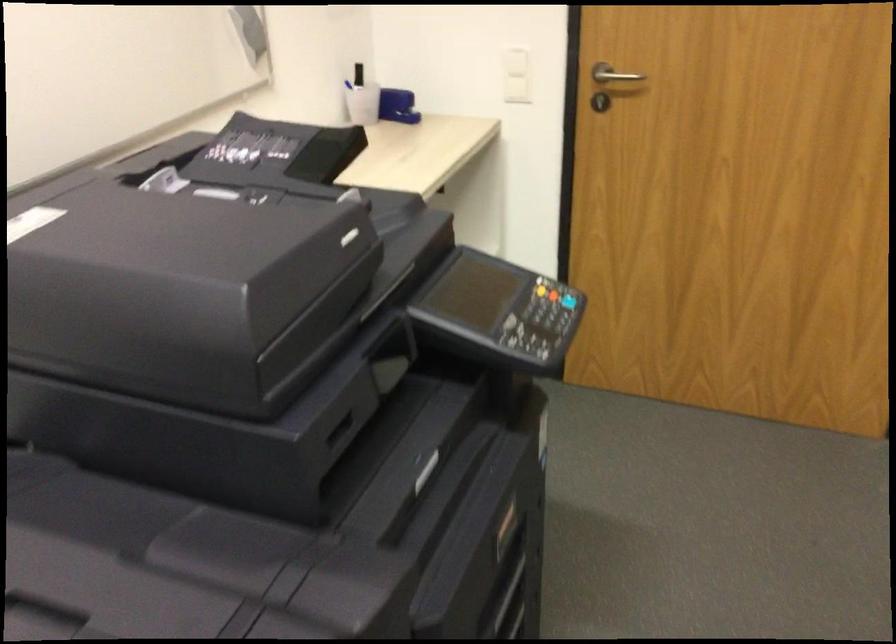
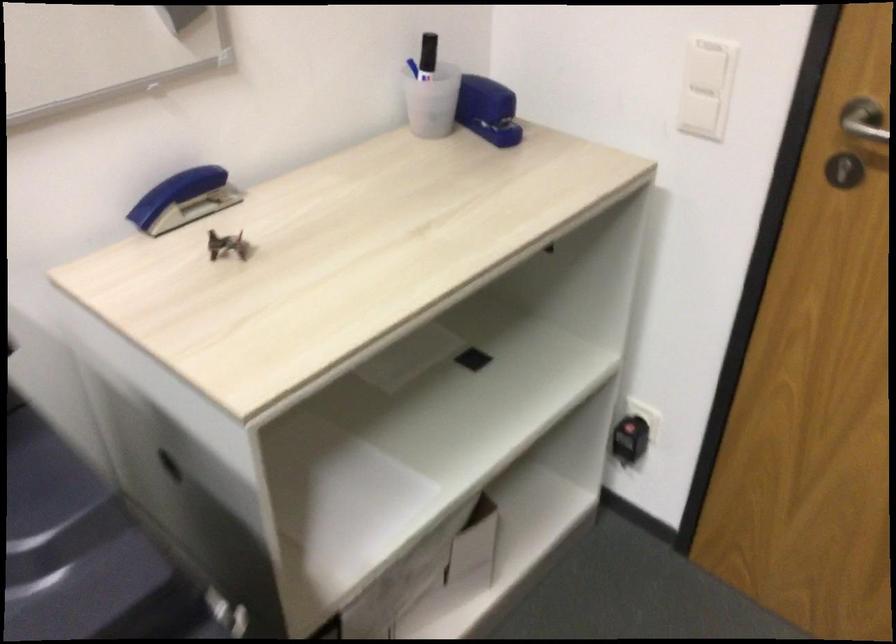
In the second image, find the point that corresponds to point (607, 106) in the first image.

(843, 169)